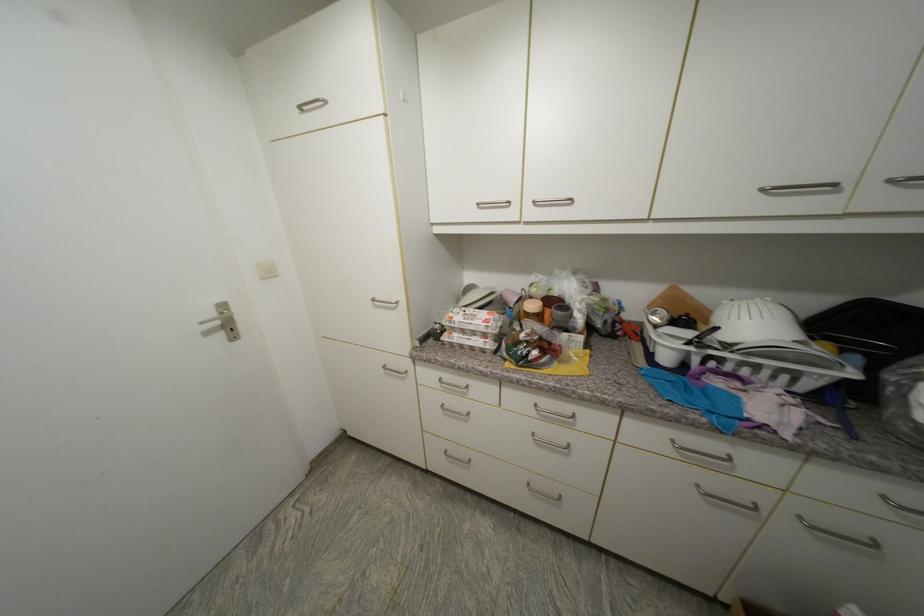
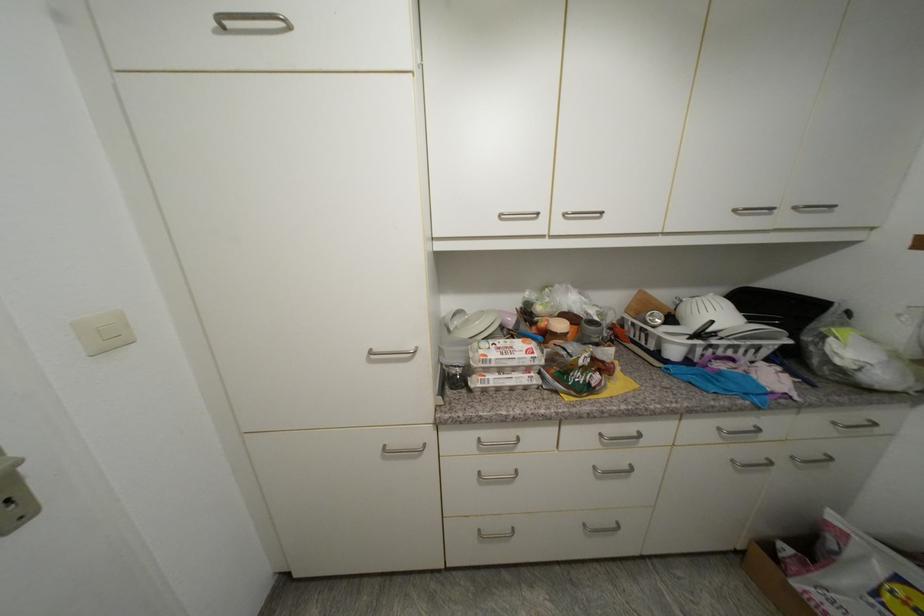
Question: I am providing you with two images of the same scene from different viewpoints. Which of the following objects are not visible in image2?

Choices:
 (A) wooden cutting board
 (B) white colander
 (C) white plate
 (D) none of these

Answer: (D)